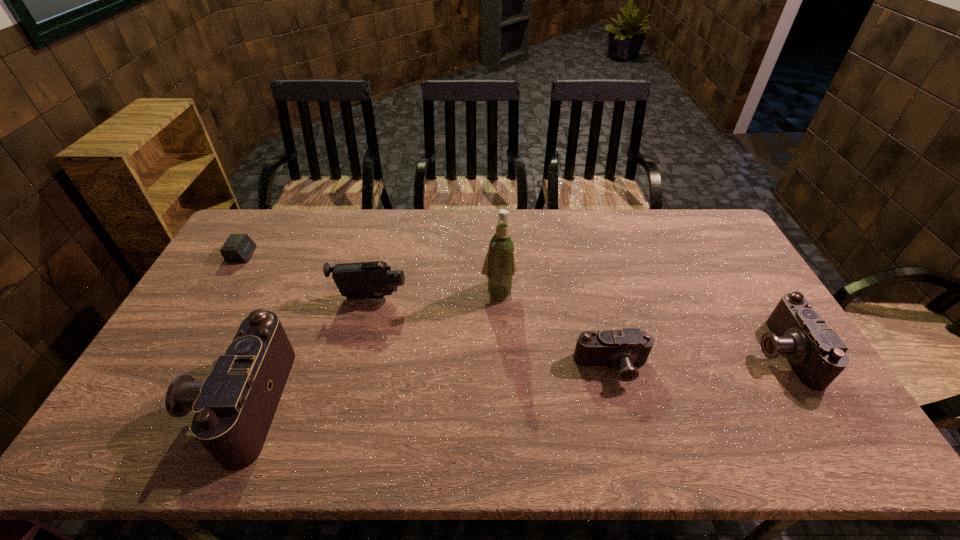
Please determine a free point for an extra camera to ensure balance. Please provide its 2D coordinates. Your answer should be formatted as a tuple, i.e. [(x, y)], where the tuple contains the x and y coordinates of a point satisfying the conditions above.

[(432, 384)]